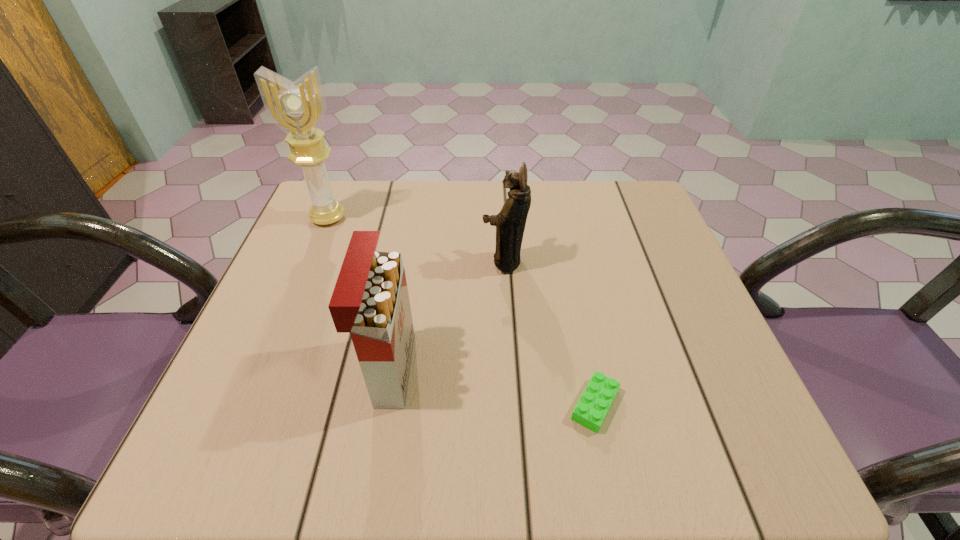
The height and width of the screenshot is (540, 960). I want to click on vacant region that satisfies the following two spatial constraints: 1. on the front-facing side of the rightmost object; 2. on the left side of the tallest object, so click(x=251, y=405).

Where is `free location that satisfies the following two spatial constraints: 1. with the lid open on the second object from left to right; 2. on the left side of the Lego`? The image size is (960, 540). free location that satisfies the following two spatial constraints: 1. with the lid open on the second object from left to right; 2. on the left side of the Lego is located at coordinates (385, 405).

Identify the location of vacant space that satisfies the following two spatial constraints: 1. on the front-facing side of the third object from left to right; 2. on the left side of the shortest object. Image resolution: width=960 pixels, height=540 pixels. click(x=513, y=405).

Locate an element on the screen. The height and width of the screenshot is (540, 960). vacant region that satisfies the following two spatial constraints: 1. with the lid open on the third object from right to left; 2. on the left side of the shortest object is located at coordinates (385, 405).